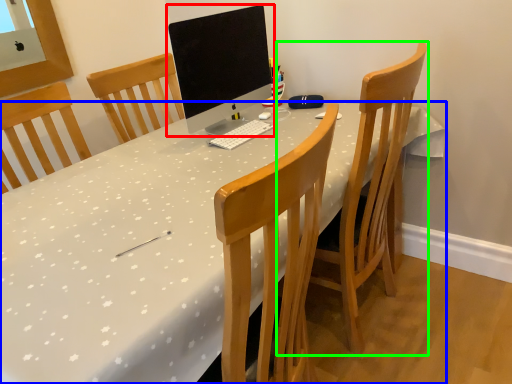
Question: Estimate the real-world distances between objects in this image. Which object is closer to computer monitor (highlighted by a red box), desk (highlighted by a blue box) or chair (highlighted by a green box)?

Choices:
 (A) desk
 (B) chair

Answer: (A)